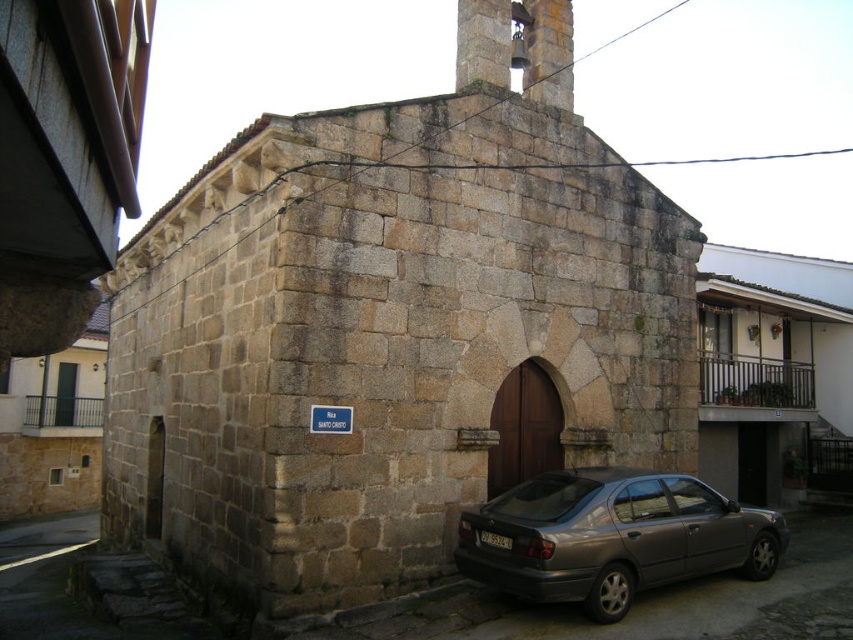
You are a visitor arriving at the village and see the stone chapel at center and the metallic gray sedan at lower right. Which object is positioned to the left when viewed from your perspective?

The stone chapel at center is positioned to the left of the metallic gray sedan at lower right.

Based on the photo, you are a photographer planning to take a photo of the stone chapel at center and the metallic gray sedan at lower right. To ensure both are in focus, you need to know which object is taller. Which one is taller?

The stone chapel at center is taller than the metallic gray sedan at lower right according to the description.